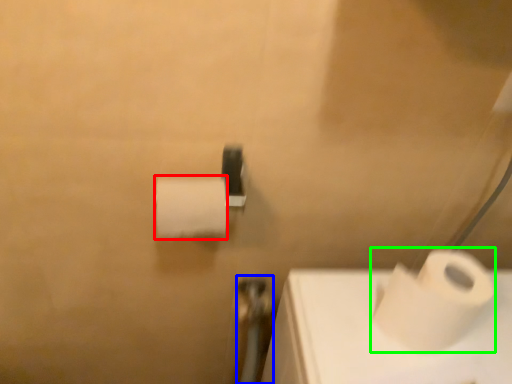
Question: Estimate the real-world distances between objects in this image. Which object is farther from toilet paper (highlighted by a red box), shower (highlighted by a blue box) or toilet paper (highlighted by a green box)?

Choices:
 (A) shower
 (B) toilet paper

Answer: (A)